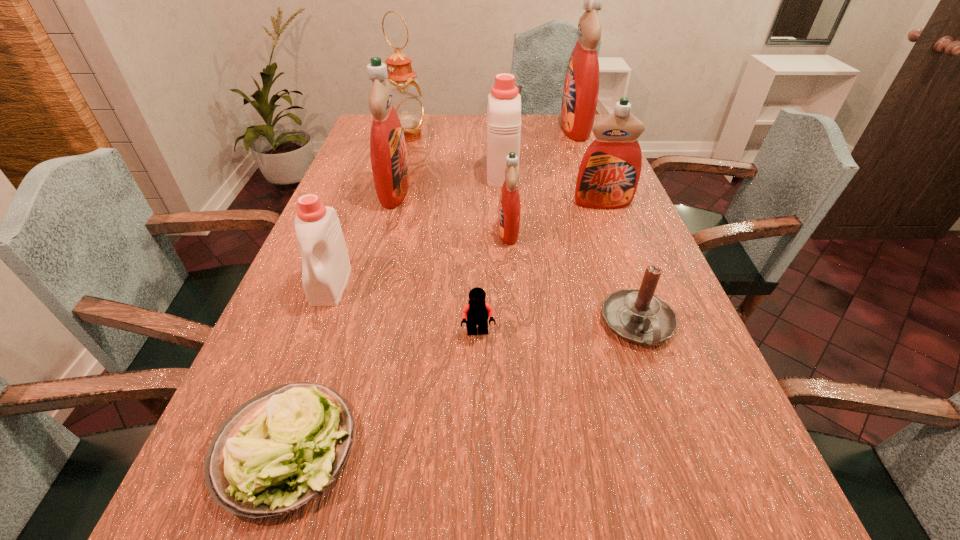
Identify the location of the third red detergent from right to left. Image resolution: width=960 pixels, height=540 pixels. (509, 211).

Identify the location of the nearest red detergent. click(509, 211).

Where is `candle`? The height and width of the screenshot is (540, 960). candle is located at coordinates (637, 315).

The width and height of the screenshot is (960, 540). Identify the location of the ninth tallest object. (477, 311).

Image resolution: width=960 pixels, height=540 pixels. Find the location of `black Lego`. black Lego is located at coordinates pos(477,311).

Locate an element on the screen. the shortest object is located at coordinates (277, 451).

The width and height of the screenshot is (960, 540). Find the location of `the nearest object`. the nearest object is located at coordinates (277, 451).

What are the coordinates of `vacant space located on the front surface of the farthest red detergent` in the screenshot? It's located at (496, 128).

Where is `vacant space situated on the front surface of the farthest red detergent`? Image resolution: width=960 pixels, height=540 pixels. vacant space situated on the front surface of the farthest red detergent is located at coordinates (499, 128).

This screenshot has width=960, height=540. What are the coordinates of `free space located on the front surface of the farthest red detergent` in the screenshot? It's located at (523, 128).